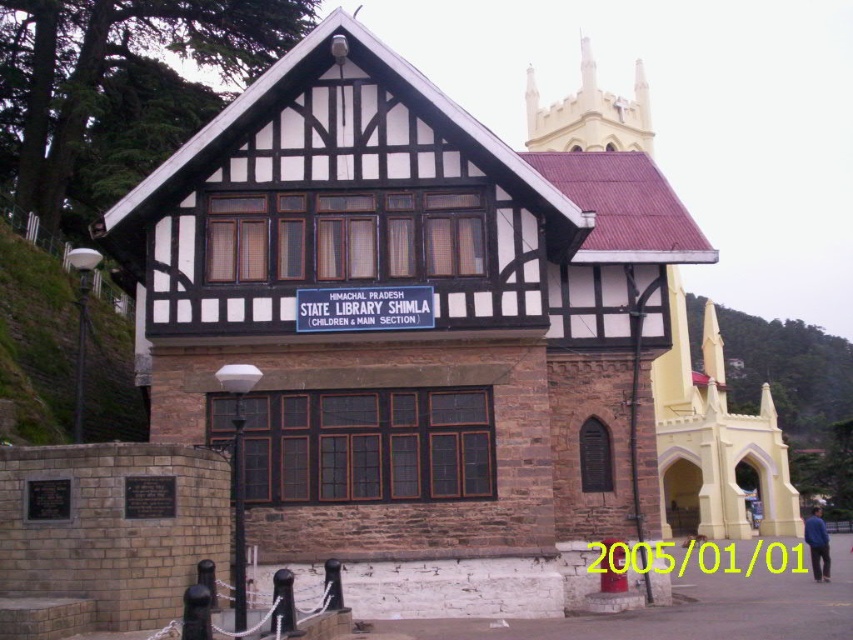
You are standing in front of the two chapels. Which chapel, the brown stone chapel at center or the smooth yellow chapel at center, is closer to you?

The brown stone chapel at center is closer to you because it is in front of the smooth yellow chapel at center.

You are standing in front of the two story building with a gabled roof and want to enter the brown stone chapel at center. Based on the image description, is the chapel located to the left or right of the building?

The brown stone chapel at center is located at point [407,317], which is at the center of the image. Since the building is described as being to the left of the chapel, the chapel is actually located to the right of the building.

You are standing in front of the two chapels. The brown stone chapel at center and the smooth yellow chapel at center. Which one is on the left side?

The brown stone chapel at center is on the left side of the smooth yellow chapel at center.